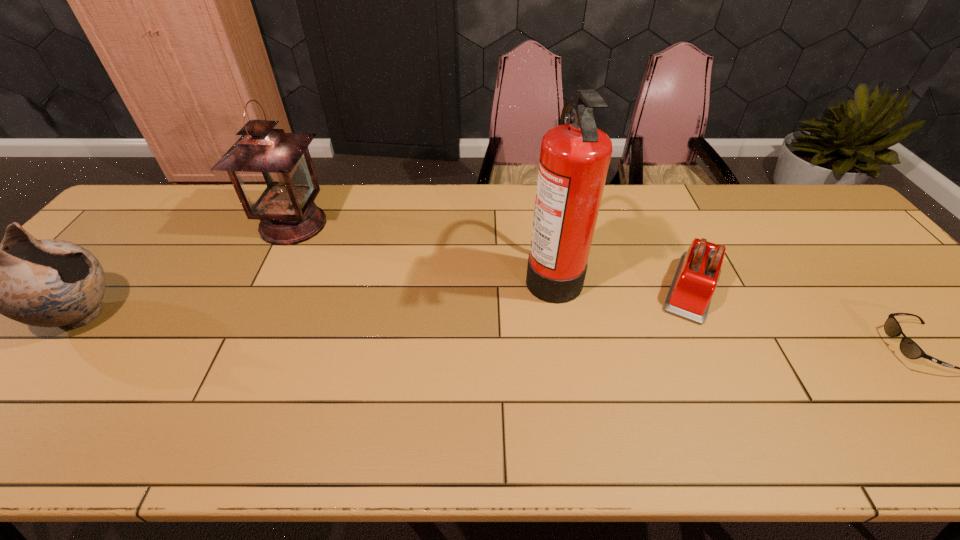
The height and width of the screenshot is (540, 960). Identify the location of free region located 0.260m on the front-facing side of the fire extinguisher. (429, 273).

Locate an element on the screen. vacant region located 0.250m on the front of the fourth shortest object is located at coordinates (250, 314).

You are a GUI agent. You are given a task and a screenshot of the screen. Output one action in this format:
    pyautogui.click(x=<x>, y=<y>)
    Task: Click on the vacant space located 0.280m from the spout of the pottery
    
    Given the screenshot: What is the action you would take?
    pyautogui.click(x=234, y=316)

Where is `vacant space situated on the right of the toaster`? vacant space situated on the right of the toaster is located at coordinates (810, 287).

At what (x,y) coordinates should I click in order to perform the action: click on object that is at the far edge. Please return your answer as a coordinate pair (x, y). This screenshot has width=960, height=540. Looking at the image, I should click on point(272,172).

This screenshot has width=960, height=540. I want to click on object that is at the left edge, so click(x=48, y=283).

Where is `free space at the far edge of the desktop`? free space at the far edge of the desktop is located at coordinates (324, 210).

What are the coordinates of `free location at the near edge of the desktop` in the screenshot? It's located at click(114, 442).

The image size is (960, 540). I want to click on vacant region at the right edge of the desktop, so click(x=920, y=310).

In the image, there is a desktop. Identify the location of vacant space at the far right corner. The image size is (960, 540). (823, 225).